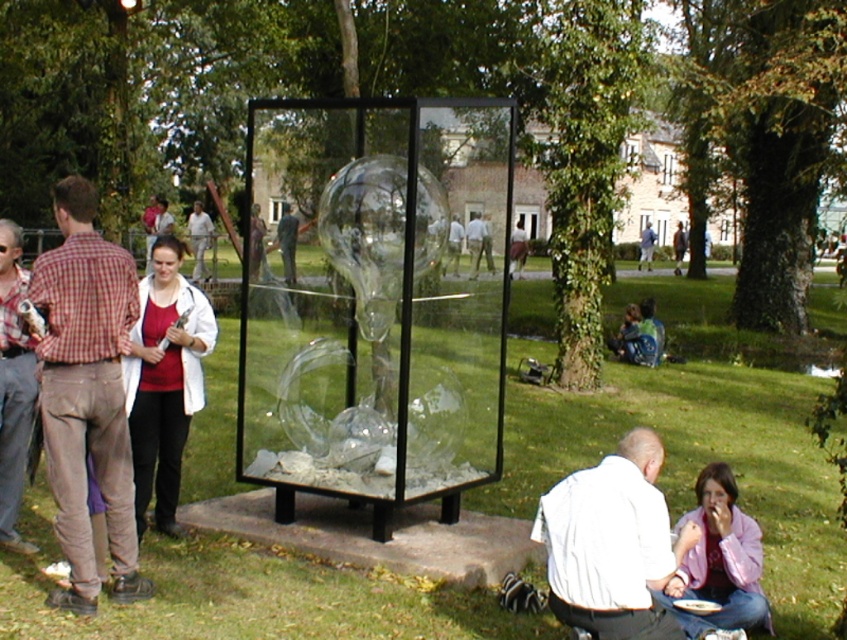
Which is more to the left, matte brown pants at left or matte plaid shirt at left?

matte plaid shirt at left

Between point (67, 237) and point (3, 301), which one is positioned behind?

Positioned behind is point (3, 301).

Where is `matte brown pants at left`? matte brown pants at left is located at coordinates (86, 394).

Is white shirt at lower right above matte plaid shirt at left?

Incorrect, white shirt at lower right is not positioned above matte plaid shirt at left.

Can you confirm if white shirt at lower right is bigger than matte plaid shirt at left?

Incorrect, white shirt at lower right is not larger than matte plaid shirt at left.

Which is in front, point (643, 612) or point (14, 445)?

Point (643, 612) is more forward.

What are the coordinates of `white shirt at lower right` in the screenshot? It's located at (612, 544).

Between transparent glass sculpture at center and white shirt at lower right, which one is positioned higher?

transparent glass sculpture at center

Is transparent glass sculpture at center bigger than white shirt at lower right?

Indeed, transparent glass sculpture at center has a larger size compared to white shirt at lower right.

The image size is (847, 640). What do you see at coordinates (375, 301) in the screenshot?
I see `transparent glass sculpture at center` at bounding box center [375, 301].

Image resolution: width=847 pixels, height=640 pixels. Identify the location of transparent glass sculpture at center. (375, 301).